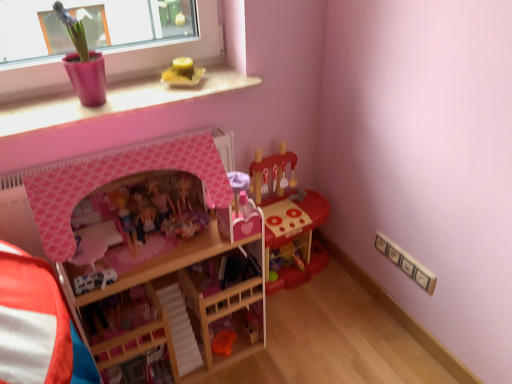
Question: Considering the relative positions of matte pink pot at upper left, arranged as the 5th toy when viewed from the right, and white plastic car at center, the fourth toy positioned from the right, in the image provided, is matte pink pot at upper left, arranged as the 5th toy when viewed from the right, to the right of white plastic car at center, the fourth toy positioned from the right, from the viewer's perspective?

Choices:
 (A) yes
 (B) no

Answer: (B)

Question: Can you confirm if matte pink pot at upper left, arranged as the 5th toy when viewed from the right, is taller than white plastic car at center, the fourth toy positioned from the right?

Choices:
 (A) no
 (B) yes

Answer: (B)

Question: From the image's perspective, would you say matte pink pot at upper left, the 1th toy in the left-to-right sequence, is positioned over white plastic car at center, the fourth toy positioned from the right?

Choices:
 (A) no
 (B) yes

Answer: (B)

Question: Is matte pink pot at upper left, arranged as the 5th toy when viewed from the right, positioned in front of white plastic car at center, the 2th toy in the left-to-right sequence?

Choices:
 (A) no
 (B) yes

Answer: (A)

Question: Can you confirm if matte pink pot at upper left, the 1th toy in the left-to-right sequence, is thinner than white plastic car at center, the 2th toy in the left-to-right sequence?

Choices:
 (A) yes
 (B) no

Answer: (B)

Question: From a real-world perspective, is matte pink pot at upper left, the 1th toy in the left-to-right sequence, physically below white plastic car at center, the 2th toy in the left-to-right sequence?

Choices:
 (A) yes
 (B) no

Answer: (B)

Question: Is wooden bunk bed at center at the right side of pink matte dollhouse at center, which is the 3th toy from right to left?

Choices:
 (A) no
 (B) yes

Answer: (B)

Question: From a real-world perspective, is wooden bunk bed at center physically below pink matte dollhouse at center, which is the 3th toy in left-to-right order?

Choices:
 (A) no
 (B) yes

Answer: (B)

Question: Can you confirm if wooden bunk bed at center is positioned to the left of pink matte dollhouse at center, which is the 3th toy from right to left?

Choices:
 (A) yes
 (B) no

Answer: (B)

Question: Is wooden bunk bed at center facing towards pink matte dollhouse at center, which is the 3th toy from right to left?

Choices:
 (A) yes
 (B) no

Answer: (A)

Question: Are wooden bunk bed at center and pink matte dollhouse at center, which is the 3th toy from right to left, located far from each other?

Choices:
 (A) no
 (B) yes

Answer: (A)

Question: Does wooden bunk bed at center have a smaller size compared to pink matte dollhouse at center, which is the 3th toy in left-to-right order?

Choices:
 (A) yes
 (B) no

Answer: (B)

Question: Does pink matte dollhouse at center, which is the 3th toy in left-to-right order, have a larger size compared to white plastic car at center, the 2th toy in the left-to-right sequence?

Choices:
 (A) yes
 (B) no

Answer: (A)